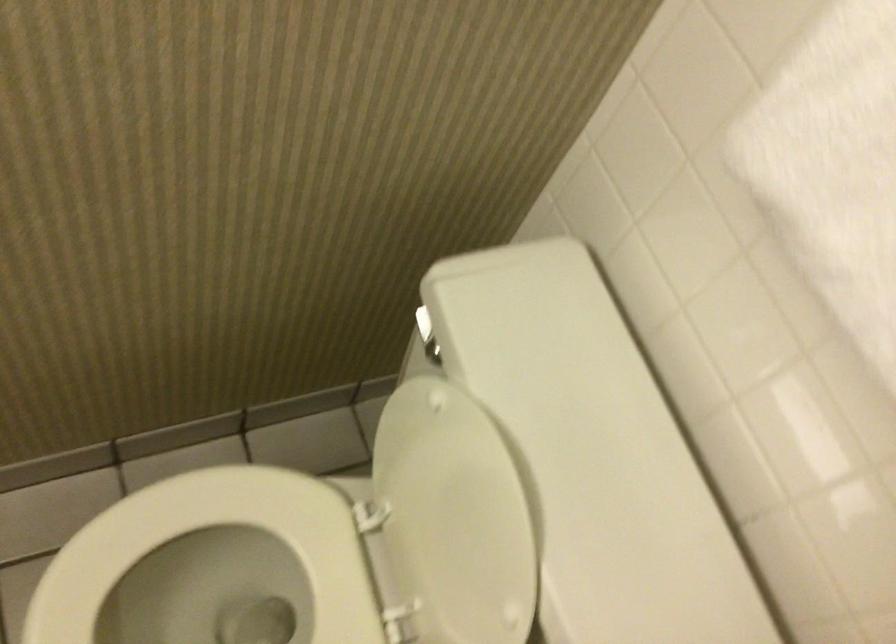
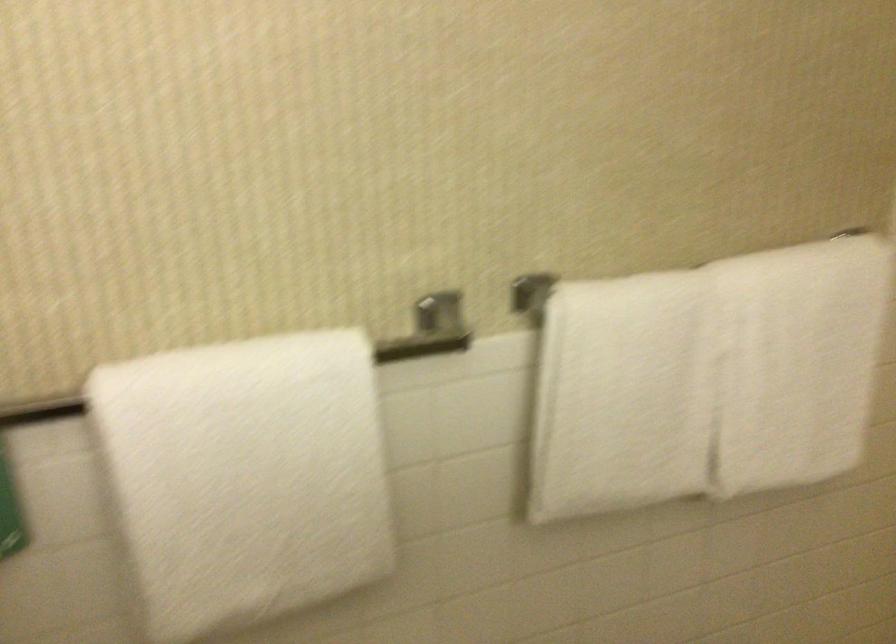
Question: The camera is either moving clockwise (left) or counter-clockwise (right) around the object. The first image is from the beginning of the video and the second image is from the end. Is the camera moving left or right when shooting the video?

Choices:
 (A) Left
 (B) Right

Answer: (A)